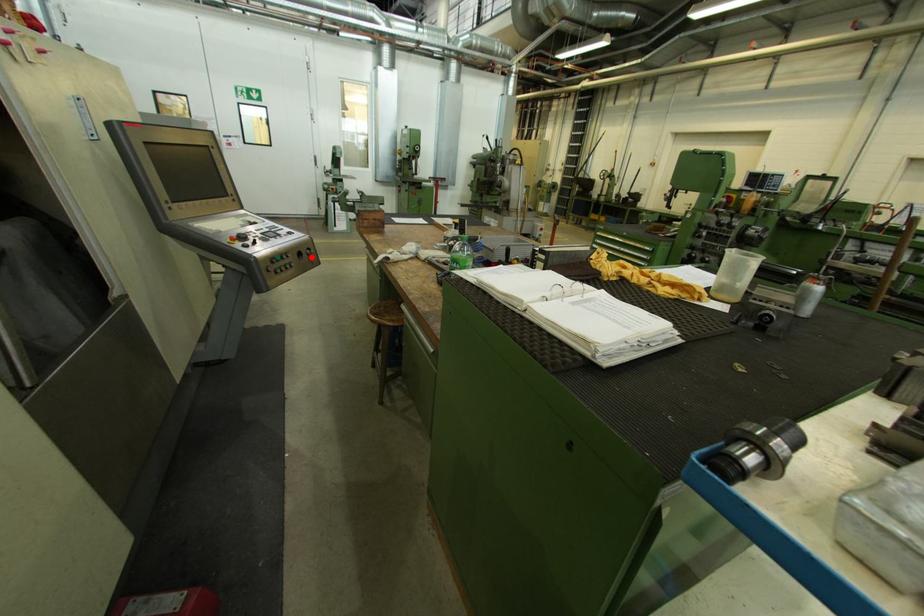
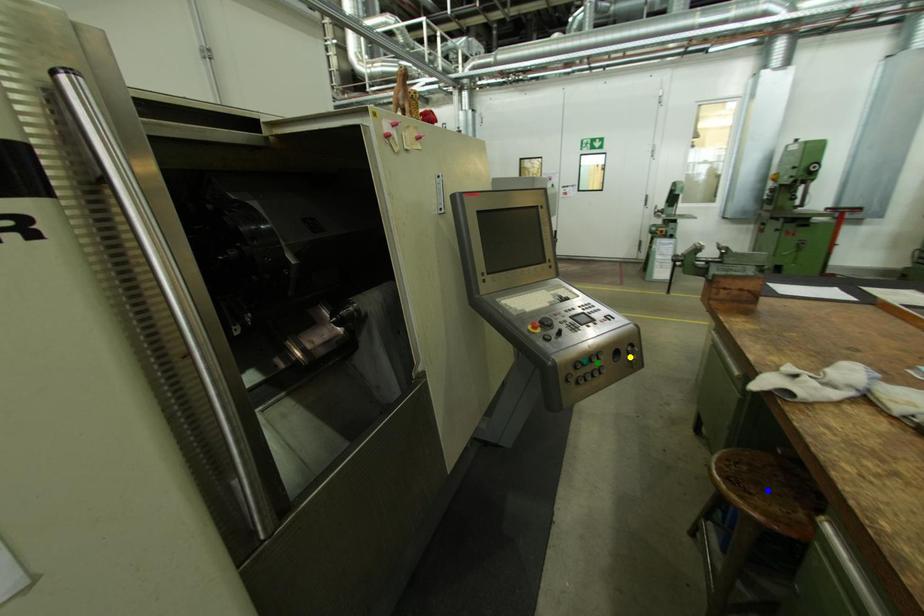
Question: I am providing you with two images of the same scene from different viewpoints. A red point is marked on the first image. You are given multiple points on the second image. Which point in image 2 represents the same 3d spot as the red point in image 1?

Choices:
 (A) yellow point
 (B) green point
 (C) blue point

Answer: (A)